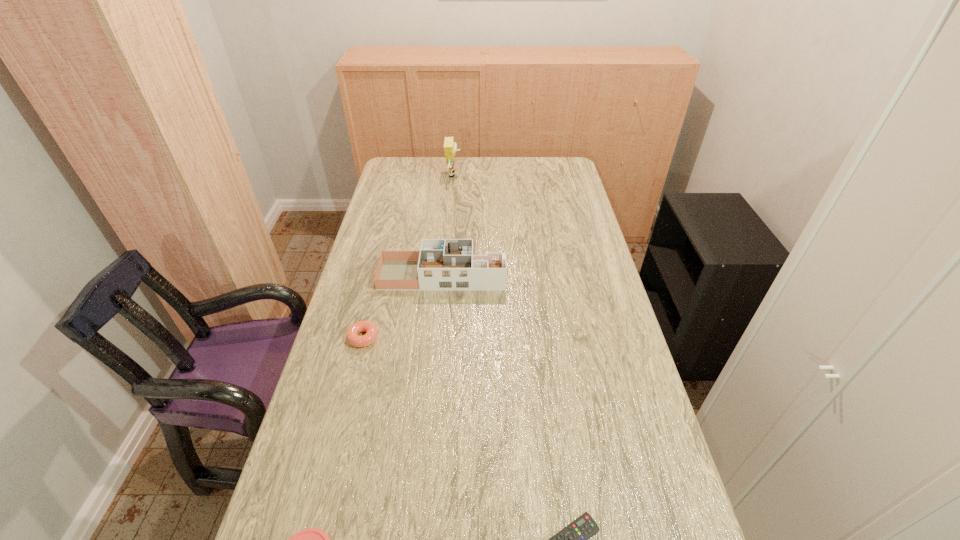
The width and height of the screenshot is (960, 540). In order to click on the tallest object in this screenshot , I will do `click(450, 147)`.

Where is `sponge`? This screenshot has width=960, height=540. sponge is located at coordinates (450, 147).

Image resolution: width=960 pixels, height=540 pixels. Find the location of `the second farthest object`. the second farthest object is located at coordinates (441, 264).

The height and width of the screenshot is (540, 960). What are the coordinates of `dollhouse` in the screenshot? It's located at tap(441, 264).

Identify the location of doughnut. This screenshot has height=540, width=960. (354, 339).

Where is `the fourth tallest object`? the fourth tallest object is located at coordinates (354, 339).

Where is `blank area located 0.300m on the face of the tallest object`? blank area located 0.300m on the face of the tallest object is located at coordinates (529, 174).

The image size is (960, 540). What are the coordinates of `vacant space located 0.210m at the entrance of the dollhouse` in the screenshot? It's located at (568, 275).

Find the location of `free location located on the right of the third nearest object`. free location located on the right of the third nearest object is located at coordinates (431, 338).

Locate an element on the screen. object that is at the far edge is located at coordinates (450, 147).